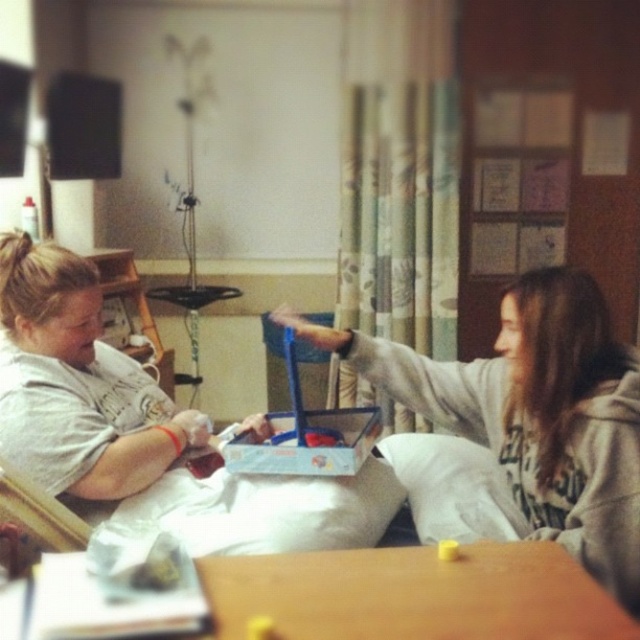
Question: Among these objects, which one is nearest to the camera?

Choices:
 (A) wooden table at center
 (B) gray fleece hoodie at upper right

Answer: (A)

Question: Is gray fleece hoodie at upper right to the right of wooden table at center from the viewer's perspective?

Choices:
 (A) yes
 (B) no

Answer: (A)

Question: Among these points, which one is farthest from the camera?

Choices:
 (A) (524, 436)
 (B) (364, 628)

Answer: (A)

Question: Is gray fleece hoodie at upper right smaller than wooden table at center?

Choices:
 (A) yes
 (B) no

Answer: (B)

Question: Can you confirm if gray fleece hoodie at upper right is positioned to the right of wooden table at center?

Choices:
 (A) yes
 (B) no

Answer: (A)